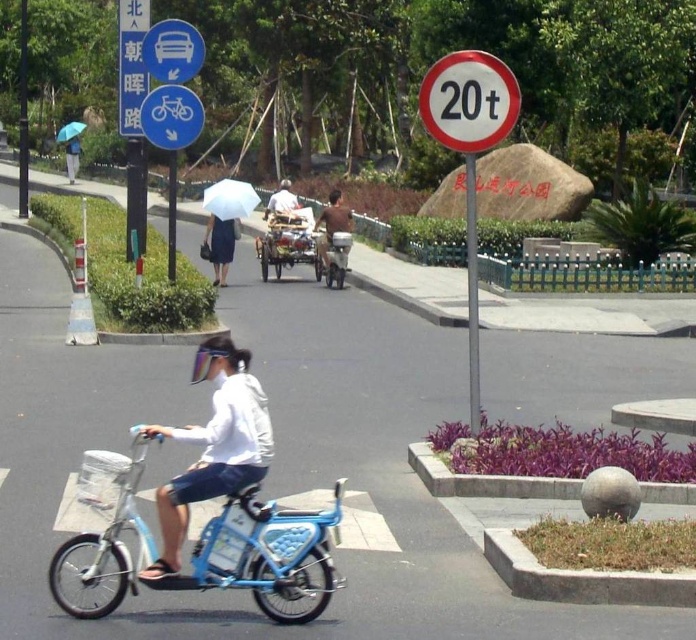
The width and height of the screenshot is (696, 640). Describe the element at coordinates (468, 100) in the screenshot. I see `red reflective sign at upper center` at that location.

Is point (466, 106) less distant than point (173, 20)?

Yes, point (466, 106) is in front of point (173, 20).

The width and height of the screenshot is (696, 640). Find the location of `red reflective sign at upper center`. red reflective sign at upper center is located at coordinates (468, 100).

Which of these two, white matte jacket at center or light brown wooden cart at center, stands shorter?

white matte jacket at center is shorter.

Is white matte jacket at center to the left of light brown wooden cart at center from the viewer's perspective?

In fact, white matte jacket at center is to the right of light brown wooden cart at center.

Which is in front, point (205, 476) or point (276, 196)?

Point (205, 476) is more forward.

This screenshot has height=640, width=696. Find the location of `white matte jacket at center`. white matte jacket at center is located at coordinates (213, 445).

Between brushed metal sign at upper left and blue plastic bicycle at upper left, which one appears on the left side from the viewer's perspective?

brushed metal sign at upper left

Which of these two, brushed metal sign at upper left or blue plastic bicycle at upper left, stands taller?

→ With more height is brushed metal sign at upper left.

Between point (129, 3) and point (177, 136), which one is positioned behind?

The point (129, 3) is behind.

What are the coordinates of `brushed metal sign at upper left` in the screenshot? It's located at (132, 64).